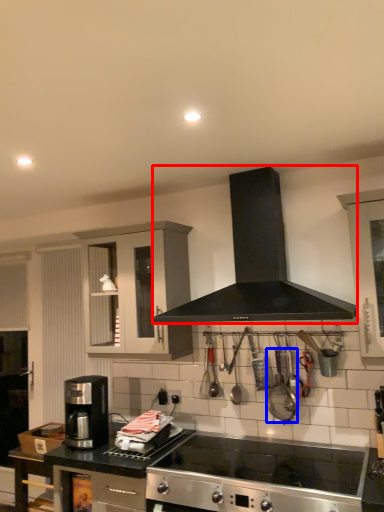
Question: Which point is closer to the camera, kitchen appliance (highlighted by a red box) or appliance (highlighted by a blue box)?

Choices:
 (A) kitchen appliance
 (B) appliance

Answer: (A)